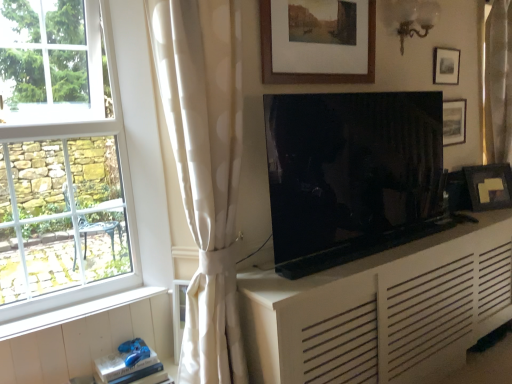
Question: Is matte black picture frame at right, the first picture frame in the right-to-left sequence, oriented towards white wood at lower left?

Choices:
 (A) no
 (B) yes

Answer: (A)

Question: From a real-world perspective, is matte black picture frame at right, the fourth picture frame in the front-to-back sequence, positioned over white wood at lower left based on gravity?

Choices:
 (A) yes
 (B) no

Answer: (A)

Question: Is matte black picture frame at right, the first picture frame in the right-to-left sequence, to the left of white wood at lower left from the viewer's perspective?

Choices:
 (A) no
 (B) yes

Answer: (A)

Question: Is matte black picture frame at right, arranged as the 4th picture frame when viewed from the left, shorter than white wood at lower left?

Choices:
 (A) yes
 (B) no

Answer: (B)

Question: Considering the relative sizes of matte black picture frame at right, arranged as the 4th picture frame when viewed from the left, and white wood at lower left in the image provided, is matte black picture frame at right, arranged as the 4th picture frame when viewed from the left, smaller than white wood at lower left?

Choices:
 (A) no
 (B) yes

Answer: (A)

Question: Relative to matte black tv at center, is matte black picture frame at upper right, which ranks as the 3th picture frame in back-to-front order, in front or behind?

Choices:
 (A) front
 (B) behind

Answer: (B)

Question: Considering the relative positions of matte black picture frame at upper right, marked as the 2th picture frame in a front-to-back arrangement, and matte black tv at center in the image provided, is matte black picture frame at upper right, marked as the 2th picture frame in a front-to-back arrangement, to the left or to the right of matte black tv at center?

Choices:
 (A) left
 (B) right

Answer: (B)

Question: Is point (458, 59) closer or farther from the camera than point (398, 99)?

Choices:
 (A) farther
 (B) closer

Answer: (A)

Question: Considering the positions of matte black picture frame at upper right, marked as the 2th picture frame in a front-to-back arrangement, and matte black tv at center in the image, is matte black picture frame at upper right, marked as the 2th picture frame in a front-to-back arrangement, bigger or smaller than matte black tv at center?

Choices:
 (A) big
 (B) small

Answer: (B)

Question: Does point (330, 211) appear closer or farther from the camera than point (123, 304)?

Choices:
 (A) farther
 (B) closer

Answer: (A)

Question: From a real-world perspective, is matte black tv at center positioned above or below white wood at lower left?

Choices:
 (A) above
 (B) below

Answer: (A)

Question: From the image's perspective, relative to white wood at lower left, is matte black tv at center above or below?

Choices:
 (A) below
 (B) above

Answer: (B)

Question: Would you say matte black tv at center is inside or outside white wood at lower left?

Choices:
 (A) inside
 (B) outside

Answer: (B)

Question: In terms of height, does white matte cabinet at center look taller or shorter compared to white glass window at left?

Choices:
 (A) tall
 (B) short

Answer: (B)

Question: Choose the correct answer: Is white matte cabinet at center inside white glass window at left or outside it?

Choices:
 (A) inside
 (B) outside

Answer: (B)